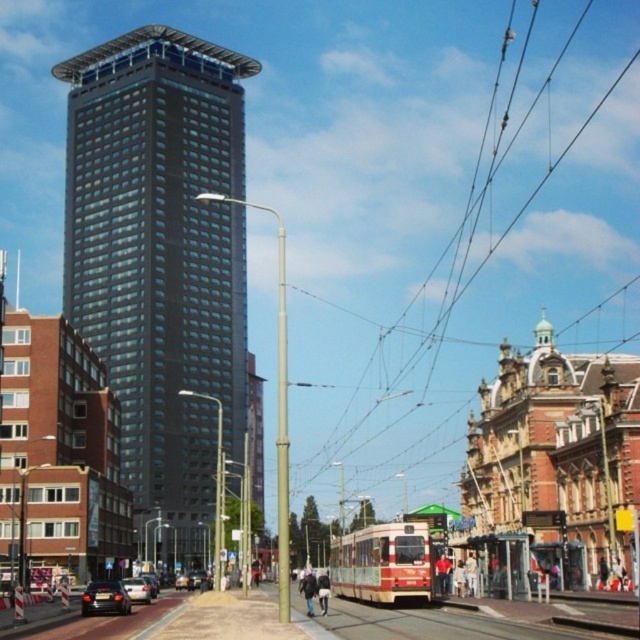
Between point (232, 432) and point (140, 598), which one is positioned in front?

Point (140, 598) is in front.

Is matte glass tower at center wider than silver metallic car at center?

Yes, matte glass tower at center is wider than silver metallic car at center.

Who is more distant from viewer, (x=184, y=445) or (x=138, y=588)?

Positioned behind is point (x=184, y=445).

In order to click on matte glass tower at center in this screenshot , I will do `click(161, 260)`.

Can you confirm if matte glass tower at center is positioned above shiny black car at lower left?

Correct, matte glass tower at center is located above shiny black car at lower left.

Who is positioned more to the left, matte glass tower at center or shiny black car at lower left?

matte glass tower at center

The height and width of the screenshot is (640, 640). Describe the element at coordinates (161, 260) in the screenshot. I see `matte glass tower at center` at that location.

Where is `matte glass tower at center`? matte glass tower at center is located at coordinates (161, 260).

Is shiny black car at lower left bigger than silver metallic car at center?

No.

Can you confirm if shiny black car at lower left is taller than silver metallic car at center?

Incorrect, shiny black car at lower left's height is not larger of silver metallic car at center's.

Image resolution: width=640 pixels, height=640 pixels. What do you see at coordinates (104, 598) in the screenshot?
I see `shiny black car at lower left` at bounding box center [104, 598].

Identify the location of shiny black car at lower left. (104, 598).